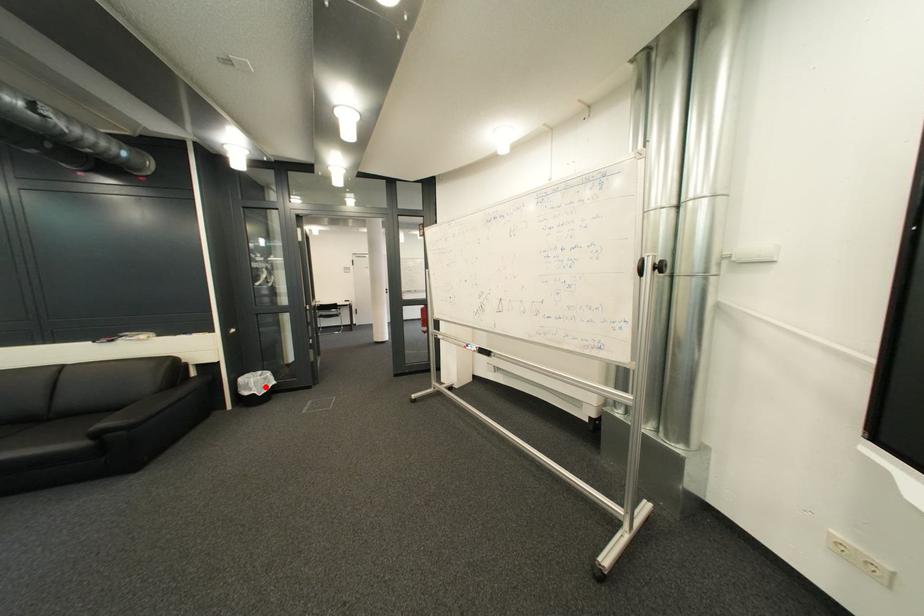
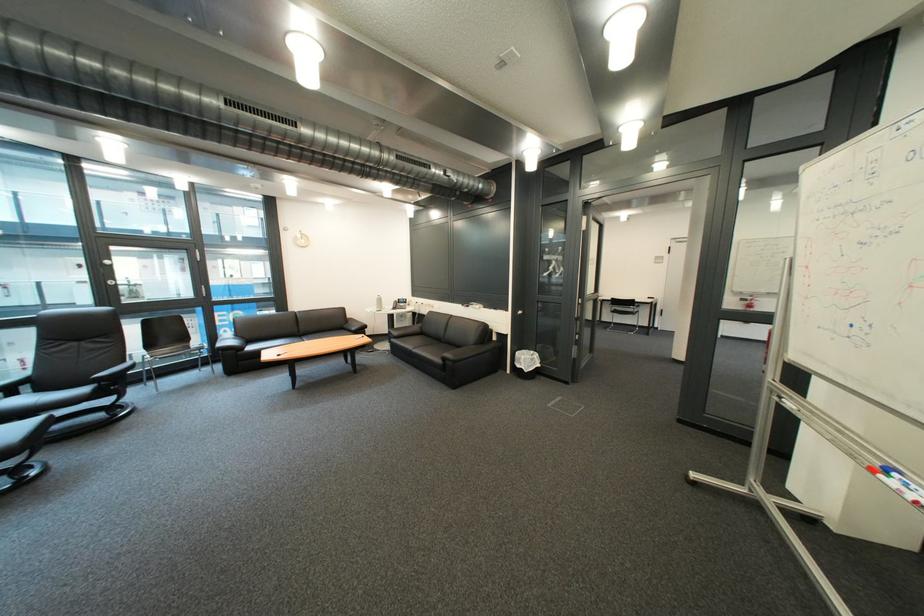
The point at the highlighted location is marked in the first image. Where is the corresponding point in the second image?

(536, 363)